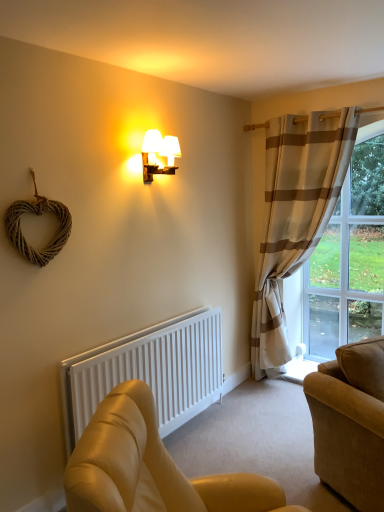
Question: Do you think white matte radiator at lower left is within leather couch at lower right, acting as the first studio couch starting from the front, or outside of it?

Choices:
 (A) inside
 (B) outside

Answer: (B)

Question: From a real-world perspective, relative to leather couch at lower right, positioned as the 2th studio couch in back-to-front order, is white matte radiator at lower left vertically above or below?

Choices:
 (A) above
 (B) below

Answer: (A)

Question: Estimate the real-world distances between objects in this image. Which object is closer to the beige striped curtain at right?

Choices:
 (A) clear glass window at right
 (B) suede-like beige couch at lower right, acting as the first studio couch starting from the back
 (C) matte gold wall sconce at upper center
 (D) leather couch at lower right, acting as the first studio couch starting from the front
 (E) white matte radiator at lower left

Answer: (A)

Question: Which of these objects is positioned closest to the suede-like beige couch at lower right, acting as the first studio couch starting from the back?

Choices:
 (A) clear glass window at right
 (B) beige striped curtain at right
 (C) matte gold wall sconce at upper center
 (D) leather couch at lower right, acting as the first studio couch starting from the front
 (E) white matte radiator at lower left

Answer: (D)